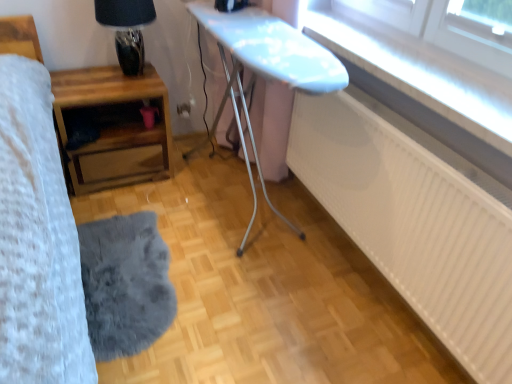
Question: Is wooden nightstand at left, which ranks as the second table in right-to-left order, positioned with its back to transparent glass window at upper right?

Choices:
 (A) no
 (B) yes

Answer: (A)

Question: Is wooden nightstand at left, which appears as the first table when viewed from the left, taller than transparent glass window at upper right?

Choices:
 (A) yes
 (B) no

Answer: (A)

Question: Considering the relative sizes of wooden nightstand at left, which appears as the first table when viewed from the left, and transparent glass window at upper right in the image provided, is wooden nightstand at left, which appears as the first table when viewed from the left, shorter than transparent glass window at upper right?

Choices:
 (A) no
 (B) yes

Answer: (A)

Question: Does wooden nightstand at left, which appears as the first table when viewed from the left, come in front of transparent glass window at upper right?

Choices:
 (A) no
 (B) yes

Answer: (A)

Question: Is transparent glass window at upper right completely or partially inside wooden nightstand at left, which ranks as the second table in right-to-left order?

Choices:
 (A) no
 (B) yes

Answer: (A)

Question: Looking at the image, does gray fluffy mat at lower left seem bigger or smaller compared to white glossy ironing board at center, the second table viewed from the left?

Choices:
 (A) small
 (B) big

Answer: (A)

Question: Relative to white glossy ironing board at center, the second table viewed from the left, is gray fluffy mat at lower left in front or behind?

Choices:
 (A) front
 (B) behind

Answer: (B)

Question: Considering the positions of point (138, 337) and point (287, 64), is point (138, 337) closer or farther from the camera than point (287, 64)?

Choices:
 (A) farther
 (B) closer

Answer: (A)

Question: Looking at their shapes, would you say gray fluffy mat at lower left is wider or thinner than white glossy ironing board at center, the second table viewed from the left?

Choices:
 (A) thin
 (B) wide

Answer: (B)

Question: From a real-world perspective, is white matte radiator at lower right physically located above or below transparent glass window at upper right?

Choices:
 (A) below
 (B) above

Answer: (A)

Question: Considering the positions of white matte radiator at lower right and transparent glass window at upper right in the image, is white matte radiator at lower right wider or thinner than transparent glass window at upper right?

Choices:
 (A) wide
 (B) thin

Answer: (B)

Question: From the image's perspective, is white matte radiator at lower right above or below transparent glass window at upper right?

Choices:
 (A) below
 (B) above

Answer: (A)

Question: Is white matte radiator at lower right bigger or smaller than transparent glass window at upper right?

Choices:
 (A) big
 (B) small

Answer: (A)

Question: From a real-world perspective, is matte glass table lamp at upper left physically located above or below white glossy ironing board at center, the second table viewed from the left?

Choices:
 (A) above
 (B) below

Answer: (A)

Question: Do you think matte glass table lamp at upper left is within white glossy ironing board at center, which appears as the first table when viewed from the right, or outside of it?

Choices:
 (A) outside
 (B) inside

Answer: (A)